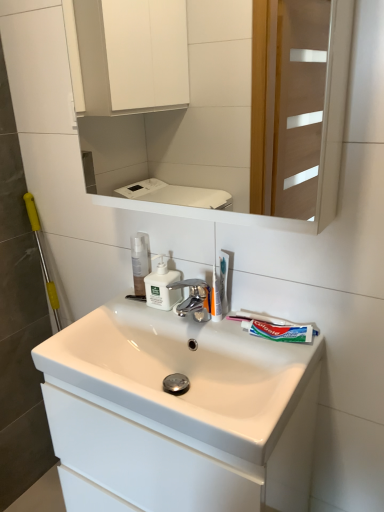
Question: Visually, is translucent plastic toothbrush at upper center positioned to the left or to the right of white glossy sink at center?

Choices:
 (A) left
 (B) right

Answer: (B)

Question: From a real-world perspective, relative to white glossy sink at center, is translucent plastic toothbrush at upper center vertically above or below?

Choices:
 (A) below
 (B) above

Answer: (B)

Question: Based on their relative distances, which object is farther from the translucent plastic toothbrush at upper center?

Choices:
 (A) transparent plastic mouthwash at center
 (B) translucent plastic toothbrush at center
 (C) white glossy sink at center
 (D) white matte toothpaste at right
 (E) white matte soap dispenser at center

Answer: (C)

Question: Estimate the real-world distances between objects in this image. Which object is closer to the white glossy sink at center?

Choices:
 (A) translucent plastic toothbrush at upper center
 (B) white matte soap dispenser at center
 (C) white matte cabinet at upper center
 (D) translucent plastic toothbrush at center
 (E) white matte toothpaste at right

Answer: (E)